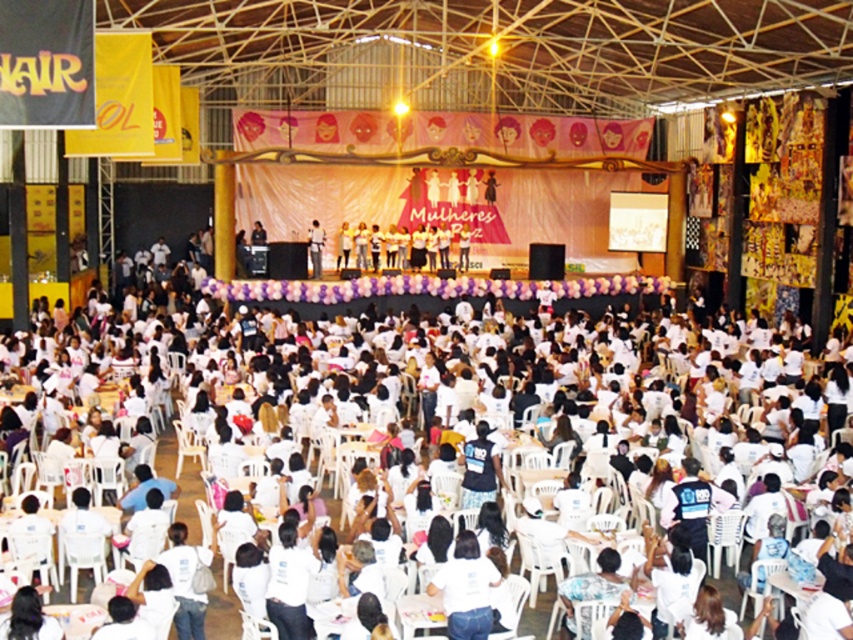
Question: Which of the following is the farthest from the observer?

Choices:
 (A) (317, 244)
 (B) (480, 600)

Answer: (A)

Question: Is white matte shirt at lower center below matte black shirt at center?

Choices:
 (A) yes
 (B) no

Answer: (A)

Question: Which object appears farthest from the camera in this image?

Choices:
 (A) matte black shirt at center
 (B) white matte shirt at lower center

Answer: (A)

Question: Is white matte shirt at lower center closer to the viewer compared to matte black shirt at center?

Choices:
 (A) no
 (B) yes

Answer: (B)

Question: Which point is farther to the camera?

Choices:
 (A) white matte shirt at lower center
 (B) matte black shirt at center

Answer: (B)

Question: Can you confirm if white matte shirt at lower center is positioned above matte black shirt at center?

Choices:
 (A) yes
 (B) no

Answer: (B)